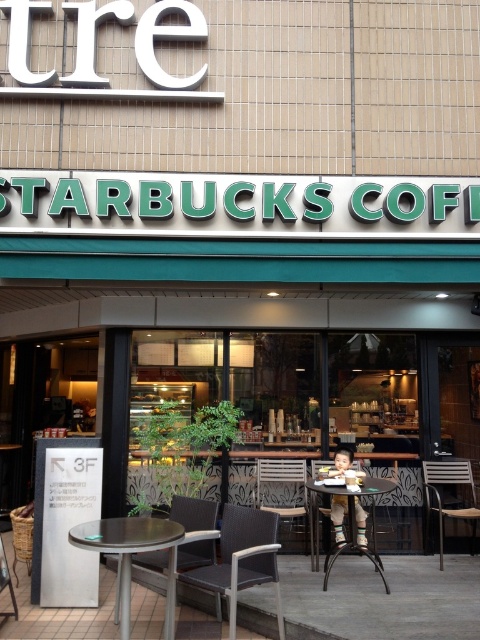
Can you confirm if metallic gray table at lower left is bigger than metallic wicker chair at lower center?

Indeed, metallic gray table at lower left has a larger size compared to metallic wicker chair at lower center.

Is metallic gray table at lower left positioned behind metallic wicker chair at lower center?

No.

Is point (120, 628) behind point (171, 515)?

That is False.

You are a GUI agent. You are given a task and a screenshot of the screen. Output one action in this format:
    pyautogui.click(x=<x>, y=<y>)
    Task: Click on the metallic gray table at lower left
    
    Given the screenshot: What is the action you would take?
    pyautogui.click(x=131, y=556)

Where is `metallic gray table at lower left`? Image resolution: width=480 pixels, height=640 pixels. metallic gray table at lower left is located at coordinates (131, 556).

The width and height of the screenshot is (480, 640). I want to click on metallic gray table at lower left, so click(x=131, y=556).

Measure the distance between metallic wicker chair at lower center and camera.

metallic wicker chair at lower center and camera are 4.70 meters apart from each other.

Measure the distance from metallic wicker chair at lower center to metallic gray chair at lower left.

metallic wicker chair at lower center is 1.25 meters from metallic gray chair at lower left.

Between point (202, 550) and point (7, 576), which one is positioned in front?

Point (7, 576)

You are a GUI agent. You are given a task and a screenshot of the screen. Output one action in this format:
    pyautogui.click(x=<x>, y=<y>)
    Task: Click on the metallic wicker chair at lower center
    The height and width of the screenshot is (640, 480).
    Given the screenshot: What is the action you would take?
    pyautogui.click(x=193, y=513)